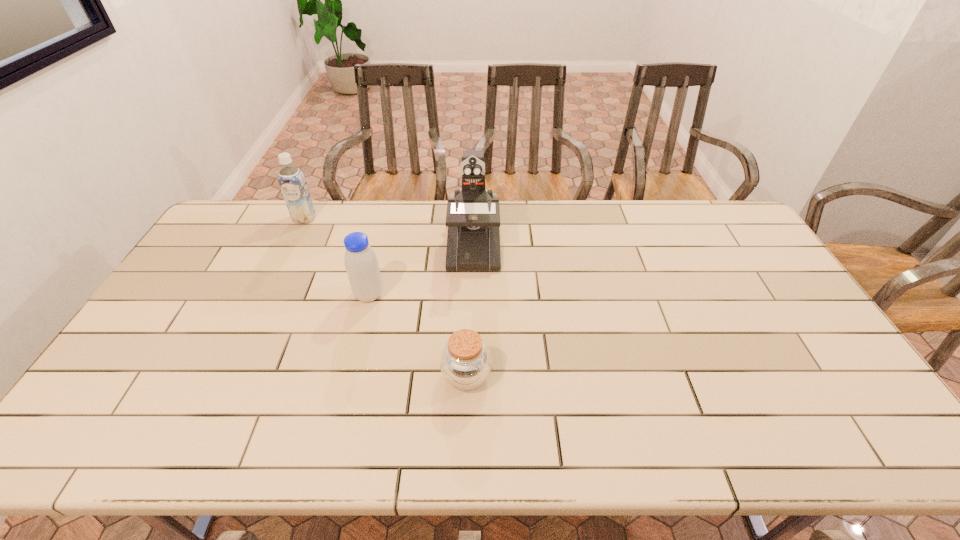
Image resolution: width=960 pixels, height=540 pixels. Identify the location of microscope. (473, 215).

Locate an element on the screen. This screenshot has height=540, width=960. the left soya milk is located at coordinates (291, 179).

Image resolution: width=960 pixels, height=540 pixels. I want to click on the leftmost object, so click(291, 179).

Find the location of a particular element. This screenshot has height=540, width=960. the second nearest object is located at coordinates (361, 263).

Find the location of a particular element. This screenshot has width=960, height=540. the nearer soya milk is located at coordinates (361, 263).

What are the coordinates of `the shortest object` in the screenshot? It's located at (465, 362).

The image size is (960, 540). In order to click on jar in this screenshot , I will do `click(465, 362)`.

The height and width of the screenshot is (540, 960). What are the coordinates of `vacant region located through the eyepieces of the microscope` in the screenshot? It's located at (471, 336).

What are the coordinates of `free region located on the label of the leftmost object` in the screenshot? It's located at (274, 284).

This screenshot has height=540, width=960. Find the location of `vacant region located on the front of the third tallest object`. vacant region located on the front of the third tallest object is located at coordinates (349, 372).